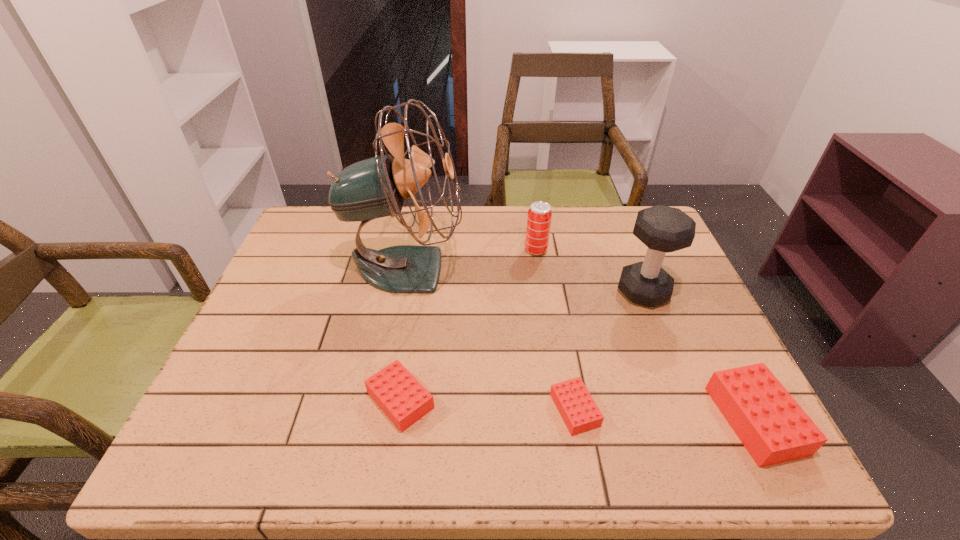
In the current image, all Legos are evenly spaced. To maintain this equal spacing, where should an additional Lego be placed on the left? Please point out a free spot. Please provide its 2D coordinates. Your answer should be formatted as a tuple, i.e. [(x, y)], where the tuple contains the x and y coordinates of a point satisfying the conditions above.

[(232, 391)]